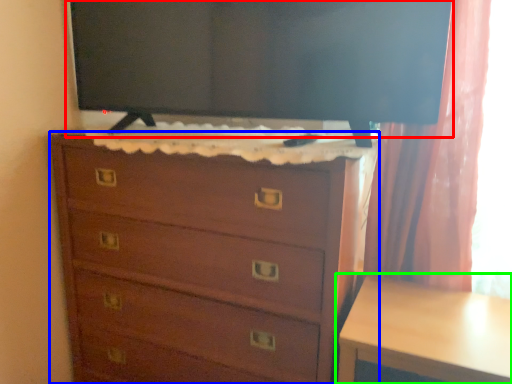
Question: Based on their relative distances, which object is farther from tv show (highlighted by a red box)? Choose from chest of drawers (highlighted by a blue box) and table (highlighted by a green box).

Choices:
 (A) chest of drawers
 (B) table

Answer: (B)